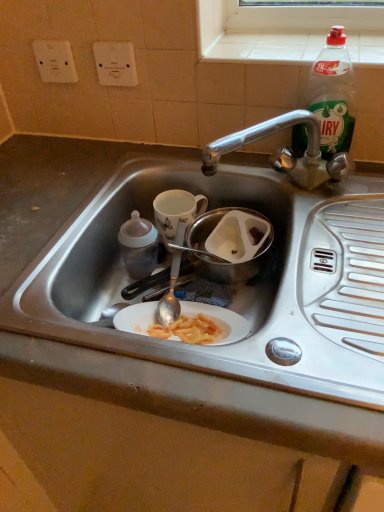
Identify the location of vacant space in front of green plastic bottle at upper right, which is the second bottle from left to right. This screenshot has width=384, height=512. (314, 193).